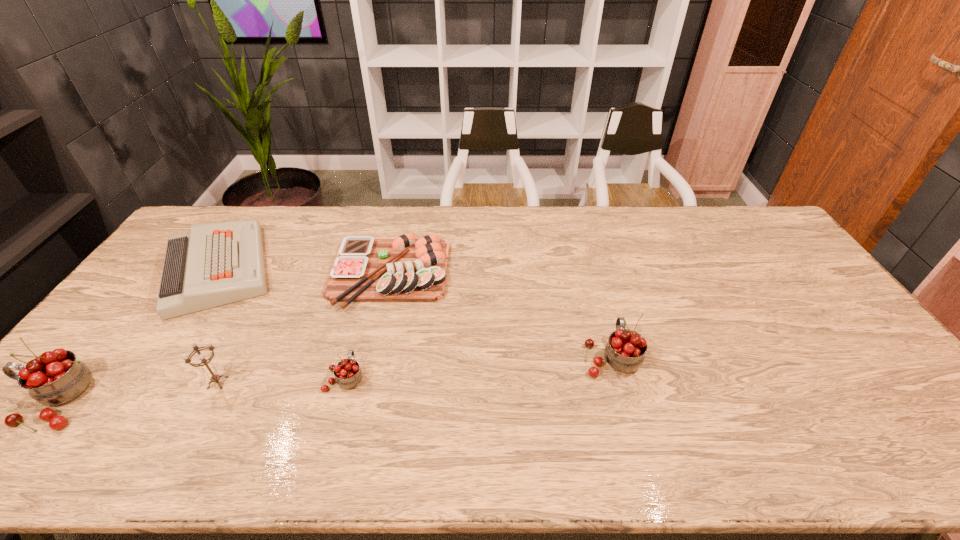
This screenshot has width=960, height=540. I want to click on free space that satisfies the following two spatial constraints: 1. on the front side of the computer keyboard; 2. on the left side of the platter, so click(214, 273).

Find the location of a particular element. Image resolution: width=960 pixels, height=540 pixels. vacant area in the image that satisfies the following two spatial constraints: 1. on the handle side of the platter; 2. on the right side of the fourth tallest object is located at coordinates (372, 273).